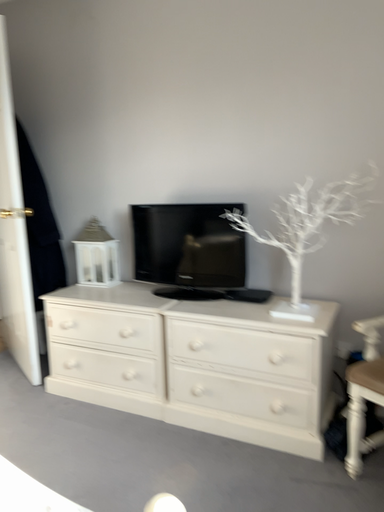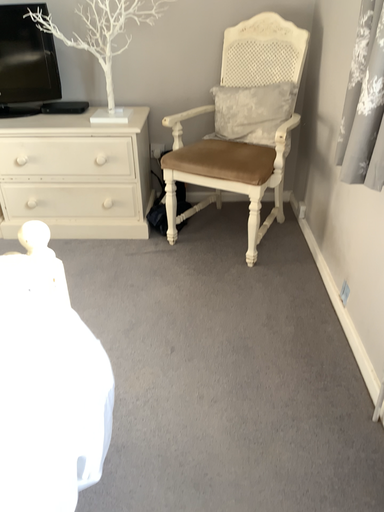
Question: How did the camera likely rotate when shooting the video?

Choices:
 (A) rotated downward
 (B) rotated upward

Answer: (A)